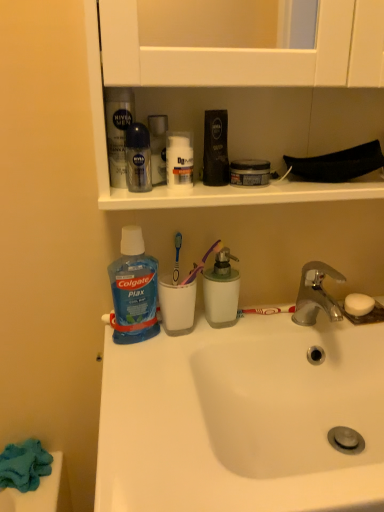
Image resolution: width=384 pixels, height=512 pixels. I want to click on free space in front of white plastic toothbrush at sink, which ranks as the 1th toothbrush in right-to-left order, so tap(267, 338).